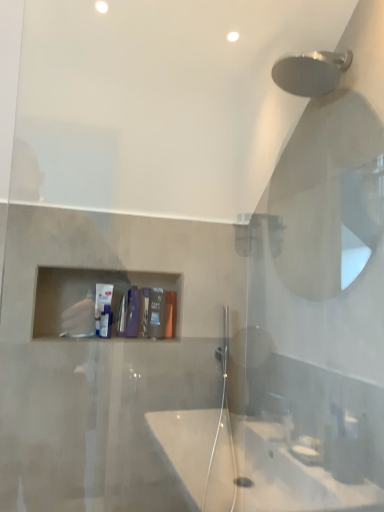
The height and width of the screenshot is (512, 384). I want to click on vacant space to the right of white matte tube at center, positioned as the 3th toiletry in right-to-left order, so click(x=136, y=337).